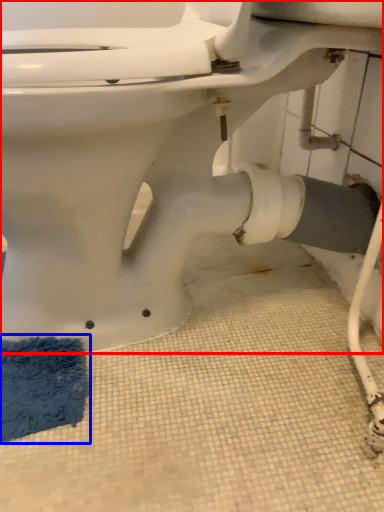
Question: Which object appears farthest to the camera in this image, toilet (highlighted by a red box) or bath mat (highlighted by a blue box)?

Choices:
 (A) toilet
 (B) bath mat

Answer: (B)